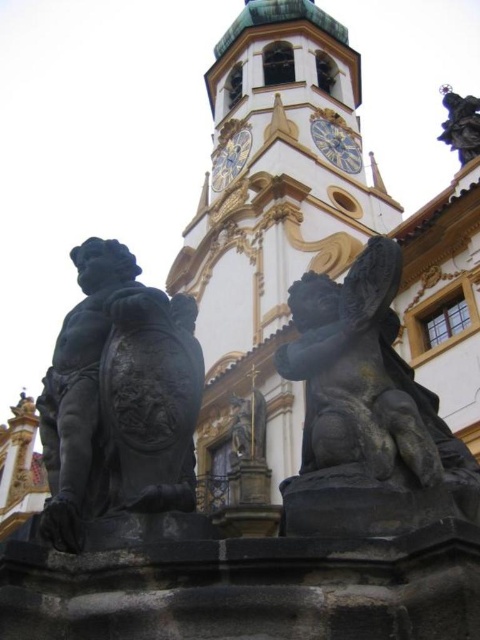
Is point (247, 220) closer to camera compared to point (47, 416)?

No.

Is point (276, 0) positioned behind point (151, 481)?

Yes, point (276, 0) is behind point (151, 481).

The width and height of the screenshot is (480, 640). Identify the location of gold-plated stone clock tower at center. (271, 228).

Who is more forward, (456,134) or (350,145)?

Point (456,134) is in front.

Can you confirm if black stone cherub at upper right is smaller than gold metallic clock at upper center?

Yes, black stone cherub at upper right is smaller than gold metallic clock at upper center.

The width and height of the screenshot is (480, 640). Describe the element at coordinates (460, 124) in the screenshot. I see `black stone cherub at upper right` at that location.

At what (x,y) coordinates should I click in order to perform the action: click on black stone cherub at upper right. Please return your answer as a coordinate pair (x, y). This screenshot has width=480, height=640. Looking at the image, I should click on (460, 124).

Can you confirm if dark gray stone cherub at right is smaller than black stone cherub at upper right?

No.

Which is in front, point (457, 467) or point (463, 132)?

Point (457, 467)

Who is more distant from viewer, (324, 483) or (465, 120)?

The point (465, 120) is more distant.

You are a GUI agent. You are given a task and a screenshot of the screen. Output one action in this format:
    pyautogui.click(x=<x>, y=<y>)
    Task: Click on the dark gray stone cherub at right
    The image size is (480, 640).
    Given the screenshot: What is the action you would take?
    pyautogui.click(x=365, y=412)